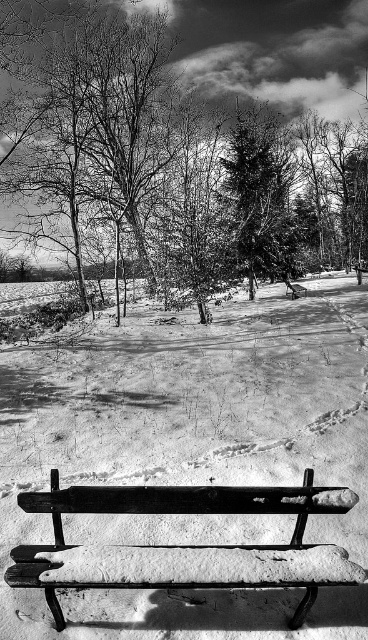
Question: Can you confirm if wooden bench at lower center is smaller than snow-covered evergreen tree at center?

Choices:
 (A) yes
 (B) no

Answer: (A)

Question: Can you confirm if wooden bench at lower center is positioned to the left of smooth bark tree at center?

Choices:
 (A) no
 (B) yes

Answer: (B)

Question: Which object is farther from the camera taking this photo?

Choices:
 (A) snow-covered evergreen tree at center
 (B) wooden bench at lower center
 (C) smooth bark tree at center

Answer: (A)

Question: Does wooden bench at lower center appear on the right side of smooth bark tree at center?

Choices:
 (A) no
 (B) yes

Answer: (A)

Question: Estimate the real-world distances between objects in this image. Which object is farther from the wooden bench at lower center?

Choices:
 (A) smooth bark tree at center
 (B) snow-covered evergreen tree at center

Answer: (A)

Question: Among these points, which one is farthest from the camera?

Choices:
 (A) (54, 618)
 (B) (324, 109)

Answer: (B)